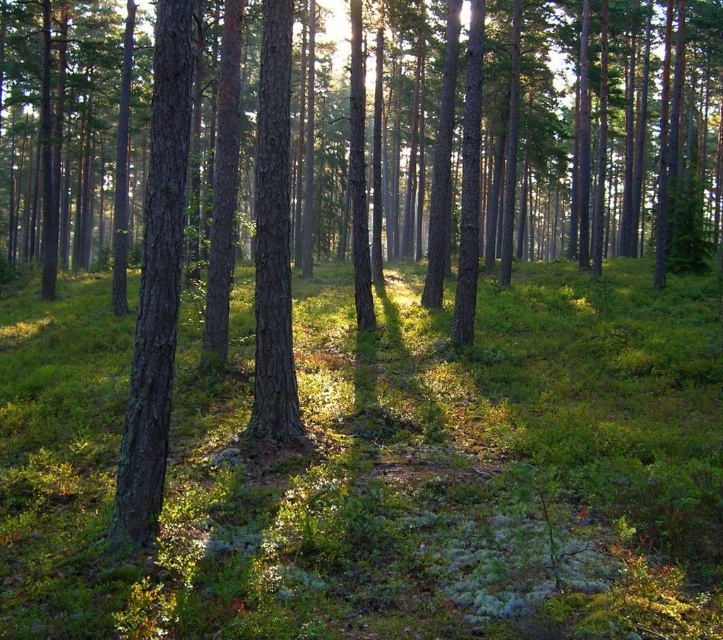
You are navigating through the forest and need to reach a specific location. You see two points marked in the scene. Which point is closer to you, point (x=174, y=296) or point (x=265, y=218)?

Point (x=174, y=296) is in front of point (x=265, y=218), so it is closer to you.

You are a hiker trying to navigate through the forest. You see the smooth brown tree trunk at left and the smooth bark tree at center. Which tree should you walk towards if you want to stay on the path that runs between them?

You should walk towards the smooth bark tree at center because the smooth brown tree trunk at left is positioned to the left of it, indicating the path is between them.